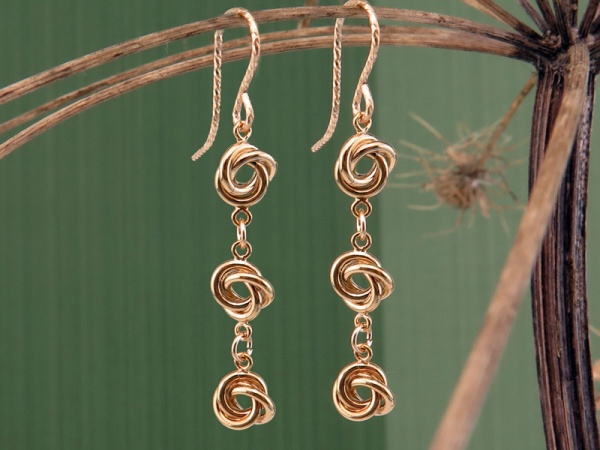
At what (x,y) coordinates should I click in order to perform the action: click on dehydrated flower. Please return your answer as a coordinate pair (x, y). The image size is (600, 450). Looking at the image, I should click on (466, 188).